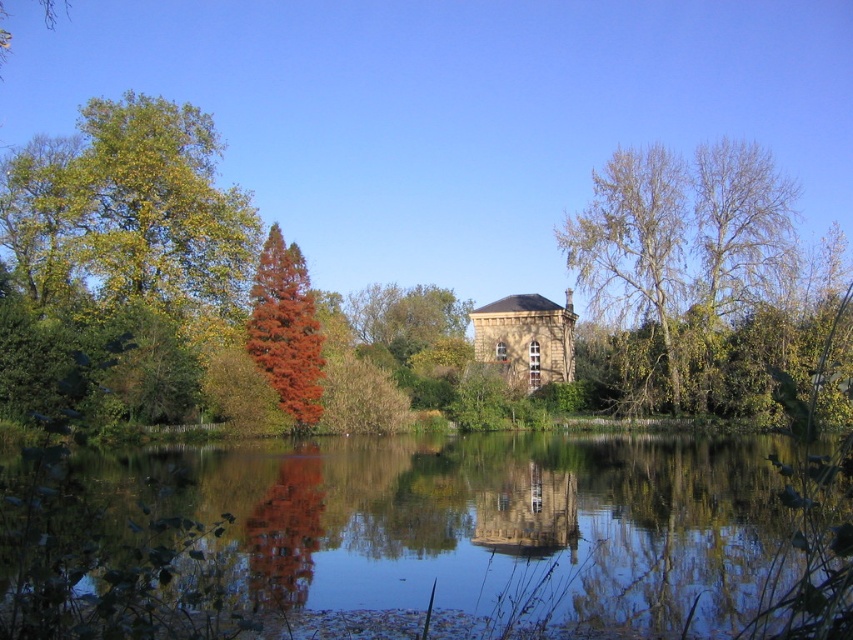
Between transparent water at center and bare wood tree at center, which one is positioned higher?

Positioned higher is bare wood tree at center.

Between transparent water at center and bare wood tree at center, which one appears on the left side from the viewer's perspective?

transparent water at center is more to the left.

Is point (252, 529) positioned behind point (640, 189)?

No, it is in front of (640, 189).

Locate an element on the screen. Image resolution: width=853 pixels, height=640 pixels. transparent water at center is located at coordinates (486, 524).

Is bare wood tree at center to the right of smooth stone tower at center from the viewer's perspective?

Indeed, bare wood tree at center is positioned on the right side of smooth stone tower at center.

Is bare wood tree at center thinner than smooth stone tower at center?

No.

Between point (614, 237) and point (538, 496), which one is positioned behind?

The point (614, 237) is behind.

Locate an element on the screen. This screenshot has width=853, height=640. bare wood tree at center is located at coordinates (631, 243).

Measure the distance between orange matte tree at center and smooth stone tower at center.

orange matte tree at center and smooth stone tower at center are 19.39 meters apart.

How much distance is there between orange matte tree at center and smooth stone tower at center?

orange matte tree at center is 19.39 meters from smooth stone tower at center.

Between point (277, 381) and point (474, 534), which one is positioned in front?

Point (474, 534)

This screenshot has height=640, width=853. What are the coordinates of `orange matte tree at center` in the screenshot? It's located at (286, 330).